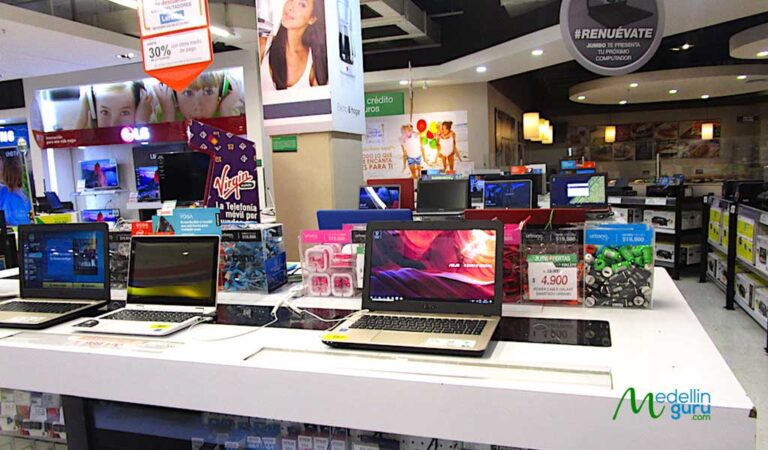
Locate an element on the screen. This screenshot has height=450, width=768. laptop is located at coordinates (475, 346).